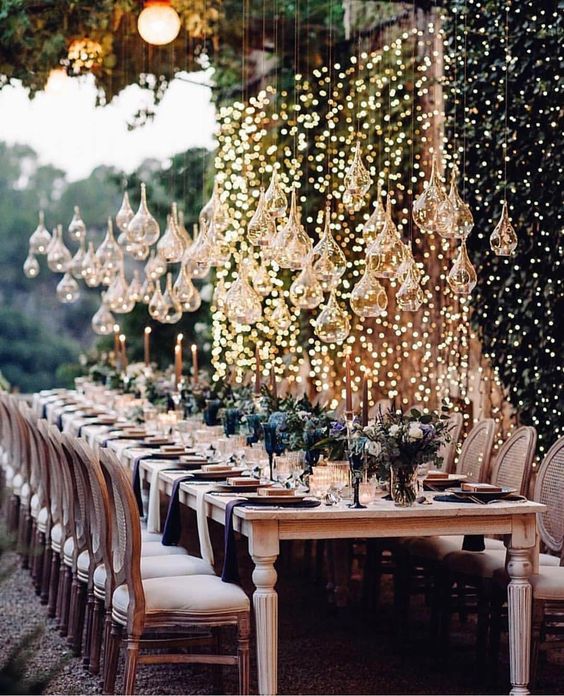
This screenshot has width=564, height=696. Identify the location of lit candlestick. (348, 390), (363, 397), (273, 381), (257, 376), (193, 360), (176, 360), (145, 348), (122, 349), (114, 349).